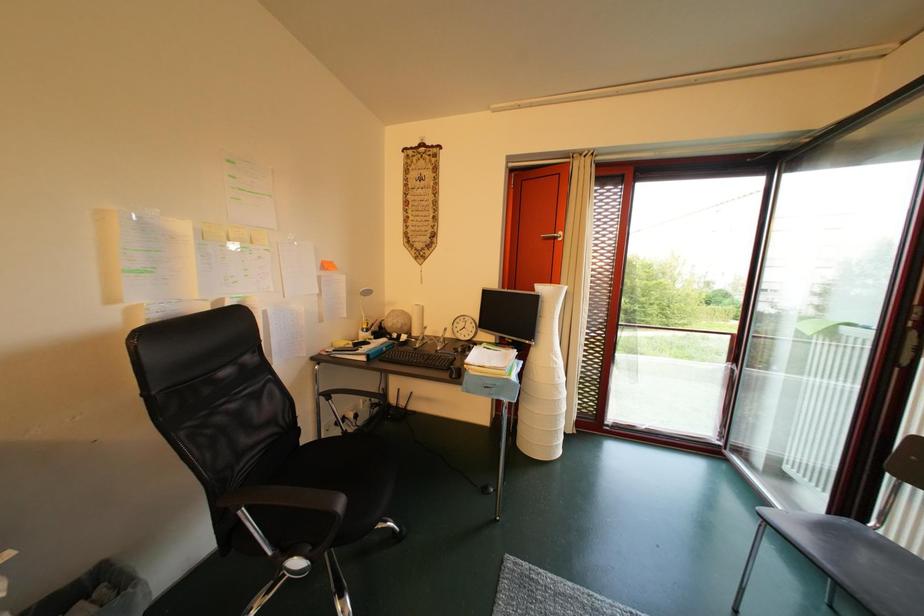
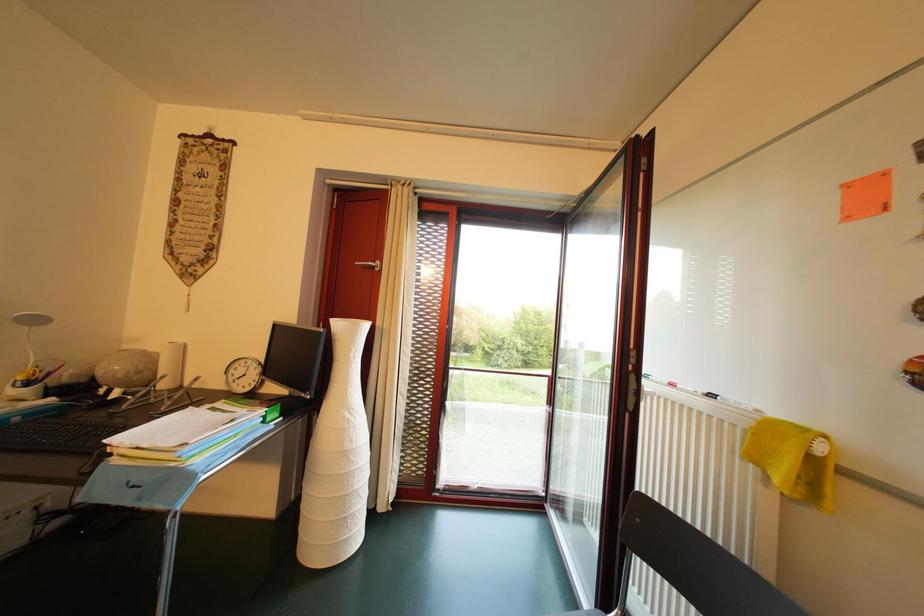
Question: The camera is either moving clockwise (left) or counter-clockwise (right) around the object. The first image is from the beginning of the video and the second image is from the end. Is the camera moving left or right when shooting the video?

Choices:
 (A) Left
 (B) Right

Answer: (A)